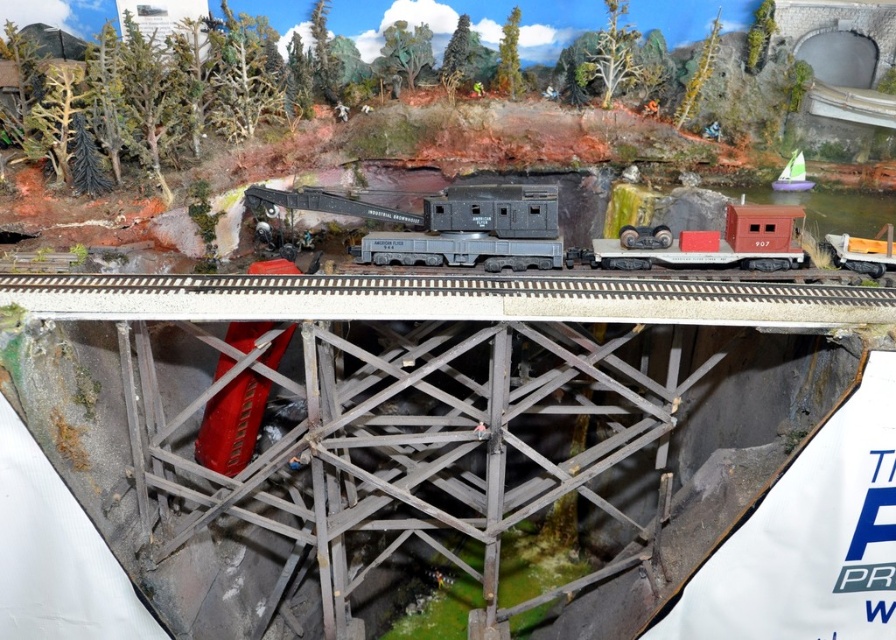
Question: Among these objects, which one is farthest from the camera?

Choices:
 (A) smooth gray train track at center
 (B) matte black locomotive at center

Answer: (B)

Question: Does smooth gray train track at center have a smaller size compared to matte black locomotive at center?

Choices:
 (A) no
 (B) yes

Answer: (B)

Question: Observing the image, what is the correct spatial positioning of smooth gray train track at center in reference to matte black locomotive at center?

Choices:
 (A) below
 (B) above

Answer: (A)

Question: Can you confirm if smooth gray train track at center is positioned below matte black locomotive at center?

Choices:
 (A) yes
 (B) no

Answer: (A)